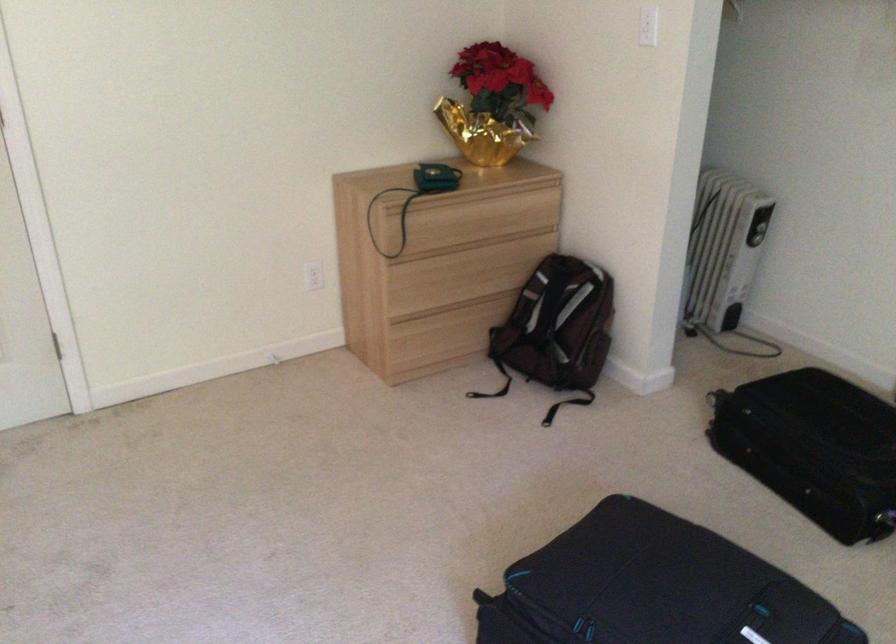
The location [435,176] corresponds to which object?

It refers to a small green purse.